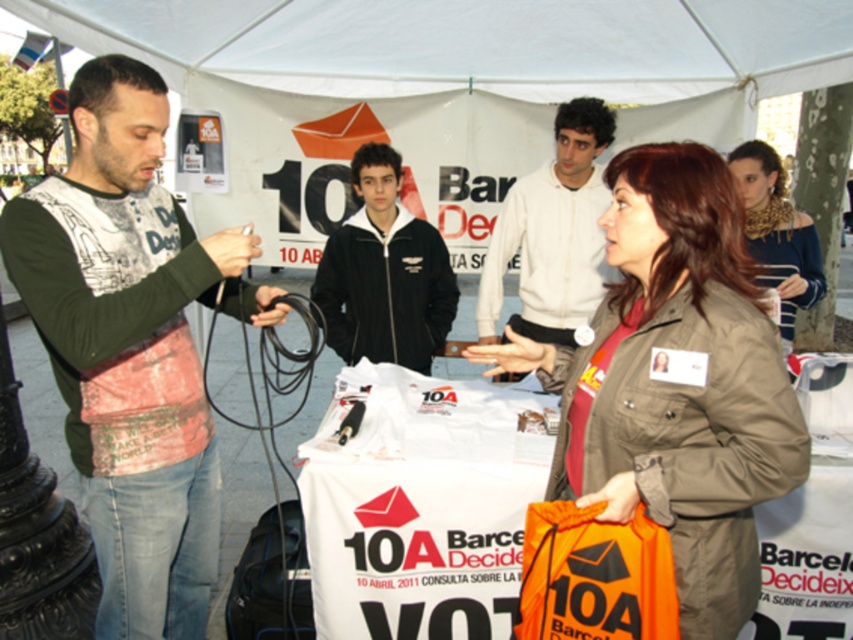
You are standing at the consultation table and notice two points marked on the tablecloth. Which point is closer to you, point (x=549, y=221) or point (x=769, y=262)?

Point (x=549, y=221) is closer to you because it is further to the viewer than point (x=769, y=262).

You are a participant at the outdoor event under the white canopy tent. You notice two items on the tablecloth with political logos. Which item is positioned lower on the tablecloth between the white cotton shirt at upper center and the leopard print scarf at upper right?

The white cotton shirt at upper center is positioned lower on the tablecloth than the leopard print scarf at upper right.